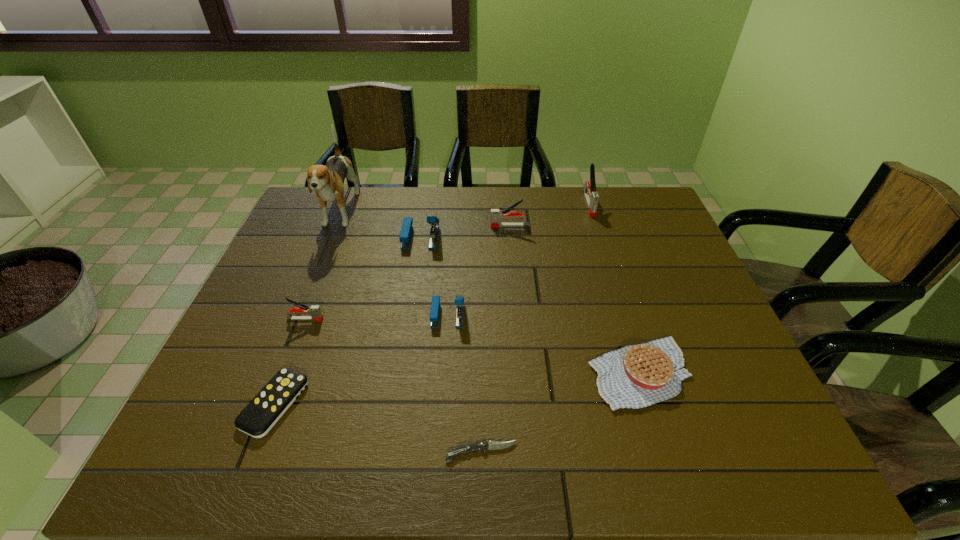
At what (x,y) coordinates should I click in order to perform the action: click on empty space between the tallest stapler and the leftmost stapler. Please return your answer as a coordinate pair (x, y). Image resolution: width=960 pixels, height=540 pixels. Looking at the image, I should click on (447, 262).

Locate an element on the screen. This screenshot has height=540, width=960. blank region between the third stapler from left to right and the biggest gray stapler is located at coordinates (518, 259).

The image size is (960, 540). Identify the location of free space between the second shortest object and the second stapler from left to right. (348, 321).

The width and height of the screenshot is (960, 540). What are the coordinates of `object that ranks as the fifth closest to the remote control` in the screenshot? It's located at (328, 180).

Image resolution: width=960 pixels, height=540 pixels. I want to click on object that is the sixth closest to the brown pie, so click(268, 406).

This screenshot has height=540, width=960. Find the location of `stapler identified as the fourth closest to the leftmost stapler`. stapler identified as the fourth closest to the leftmost stapler is located at coordinates (591, 196).

Locate which stapler is the fourth closest to the third stapler from right to left. Please provide its 2D coordinates. Your answer should be formatted as a tuple, i.e. [(x, y)], where the tuple contains the x and y coordinates of a point satisfying the conditions above.

[(591, 196)]

Locate an element on the screen. the second closest gray stapler to the nearest gray stapler is located at coordinates (591, 196).

In order to click on the third closest gray stapler to the left blue stapler in this screenshot , I will do `click(591, 196)`.

Find the location of a particular element. vacant space that satisfies the following two spatial constraints: 1. on the handle side of the remote control; 2. on the left side of the leftmost stapler is located at coordinates (273, 404).